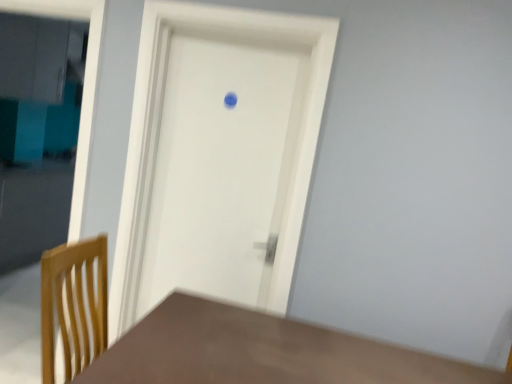
Question: Should I look upward or downward to see brown matte table at lower left?

Choices:
 (A) up
 (B) down

Answer: (B)

Question: Considering the relative sizes of brown matte table at lower left and white matte door at center in the image provided, is brown matte table at lower left bigger than white matte door at center?

Choices:
 (A) yes
 (B) no

Answer: (A)

Question: From the image's perspective, is brown matte table at lower left on top of white matte door at center?

Choices:
 (A) no
 (B) yes

Answer: (A)

Question: Considering the relative sizes of brown matte table at lower left and white matte door at center in the image provided, is brown matte table at lower left smaller than white matte door at center?

Choices:
 (A) no
 (B) yes

Answer: (A)

Question: Can you confirm if brown matte table at lower left is taller than white matte door at center?

Choices:
 (A) yes
 (B) no

Answer: (B)

Question: Does brown matte table at lower left have a greater width compared to white matte door at center?

Choices:
 (A) yes
 (B) no

Answer: (A)

Question: Considering the relative sizes of brown matte table at lower left and white matte door at center in the image provided, is brown matte table at lower left thinner than white matte door at center?

Choices:
 (A) no
 (B) yes

Answer: (A)

Question: From the image's perspective, is white matte door at center on brown matte table at lower left?

Choices:
 (A) yes
 (B) no

Answer: (A)

Question: From a real-world perspective, is white matte door at center below brown matte table at lower left?

Choices:
 (A) yes
 (B) no

Answer: (B)

Question: Is white matte door at center not within brown matte table at lower left?

Choices:
 (A) no
 (B) yes

Answer: (B)

Question: Does white matte door at center have a smaller size compared to brown matte table at lower left?

Choices:
 (A) yes
 (B) no

Answer: (A)

Question: Can you confirm if white matte door at center is taller than brown matte table at lower left?

Choices:
 (A) yes
 (B) no

Answer: (A)

Question: Does white matte door at center contain brown matte table at lower left?

Choices:
 (A) yes
 (B) no

Answer: (B)

Question: Which is correct: white matte door at center is inside brown matte table at lower left, or outside of it?

Choices:
 (A) outside
 (B) inside

Answer: (A)